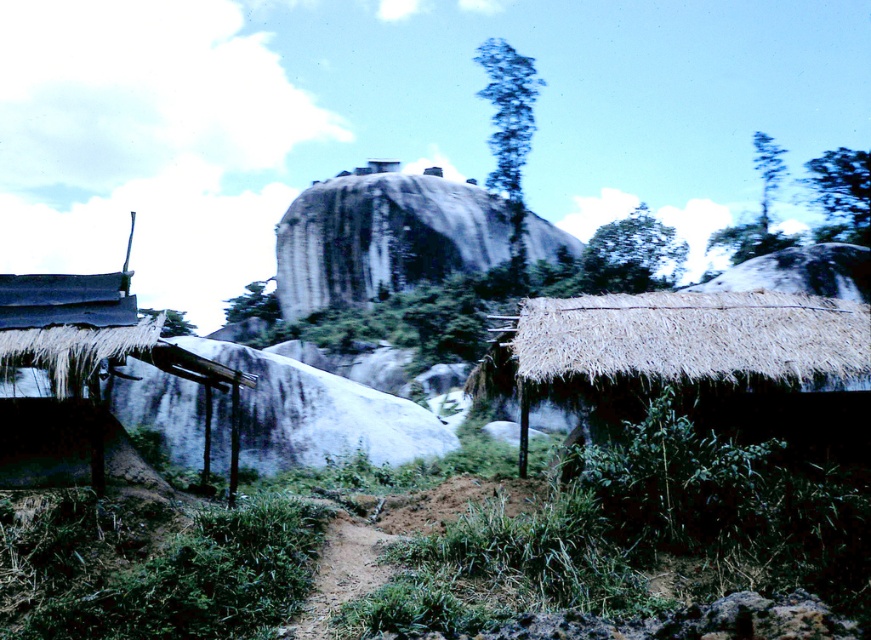
You are standing at the point marked by the coordinates (x=701, y=360) in the image. Looking around, you see the thatched straw hut at lower right and the large rock formation in the background. Which structure is closer to your current position?

The thatched straw hut at lower right is closer to your current position marked by the coordinates (x=701, y=360) because the point marks its location.

You are standing in the rural landscape and want to take a photo of the rough stone mountain at center and the dark gray thatched roof at left. Which object should you frame first in your camera viewfinder to ensure both are in the shot?

You should frame the dark gray thatched roof at left first because the rough stone mountain at center is positioned to its right, so starting with the leftmost object ensures both are included in the frame.